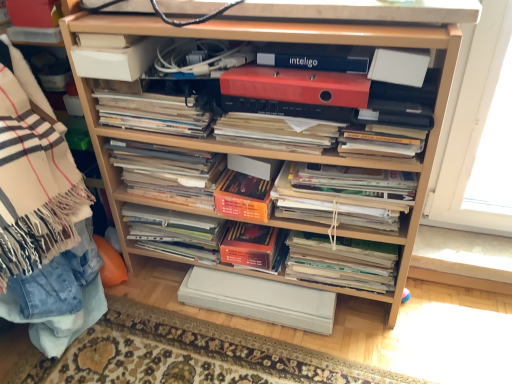
Identify the location of vacant area to the right of matte orange paperback book at center, which appears as the 1th paperback book when ordered from the bottom. The width and height of the screenshot is (512, 384). (394, 333).